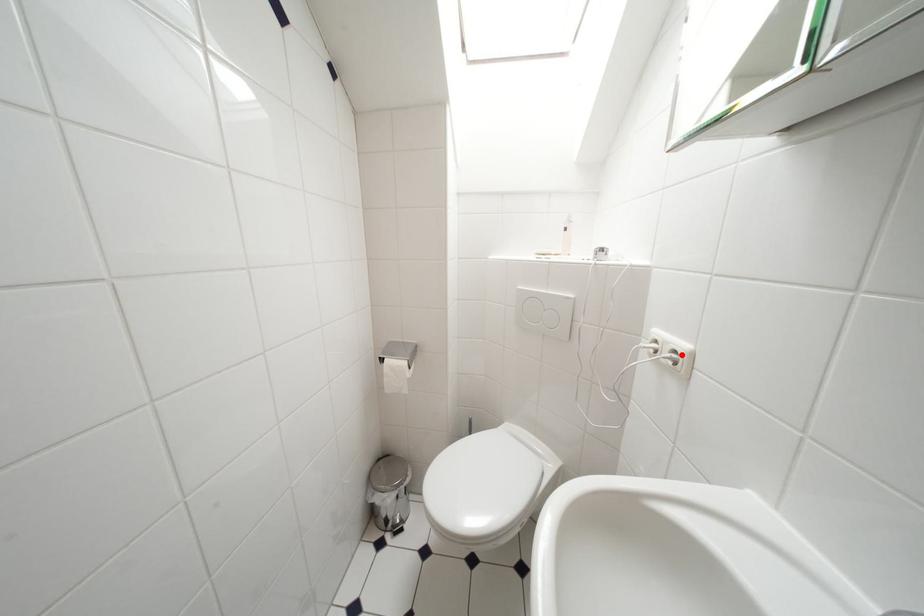
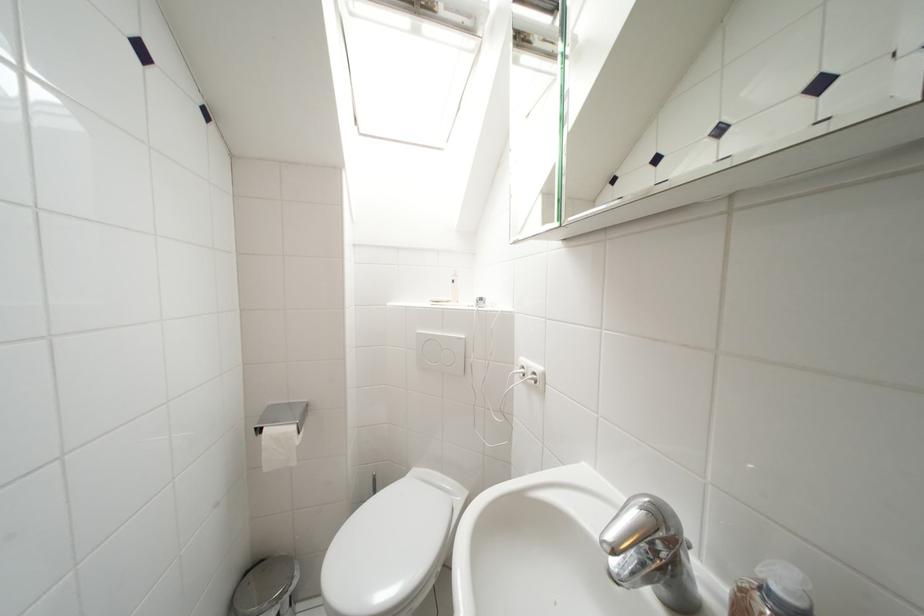
Where in the second image is the point corresponding to the highlighted location from the first image?

(541, 377)